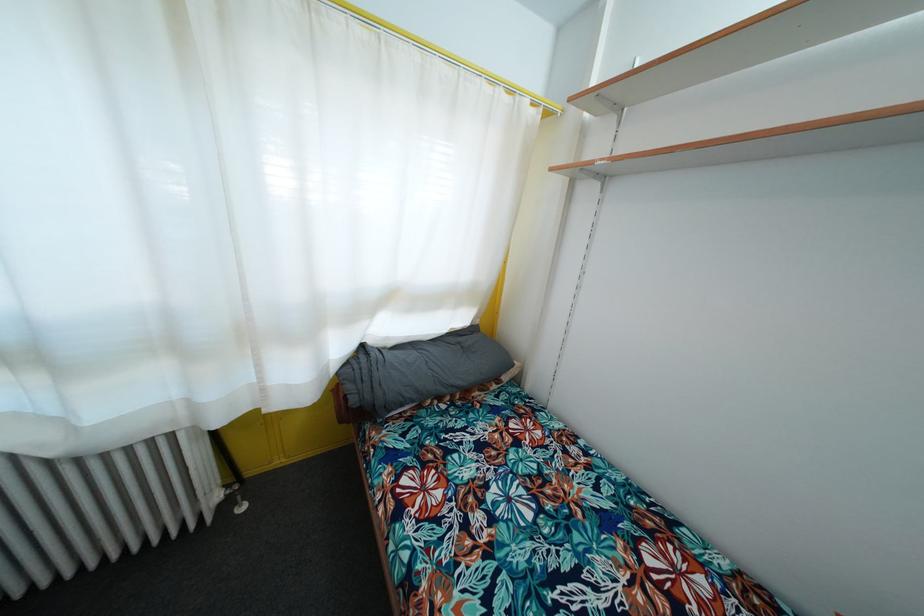
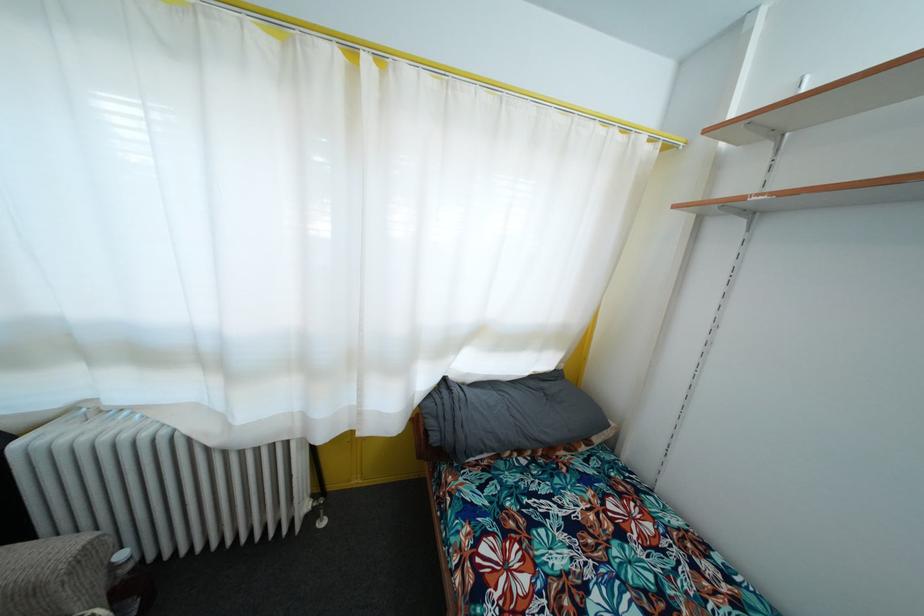
Question: The camera is either moving clockwise (left) or counter-clockwise (right) around the object. The first image is from the beginning of the video and the second image is from the end. Is the camera moving left or right when shooting the video?

Choices:
 (A) Left
 (B) Right

Answer: (B)